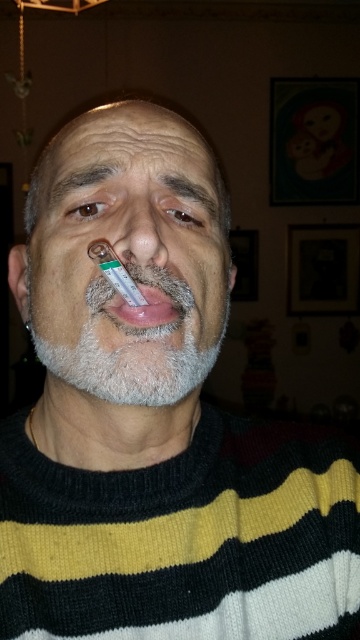
Question: Which of these objects is positioned farthest from the white matte thermometer at center?

Choices:
 (A) gray hair at upper center
 (B) brown hair at upper center

Answer: (B)

Question: Which point appears closest to the camera in this image?

Choices:
 (A) (62, 289)
 (B) (141, 202)
 (C) (106, 314)

Answer: (C)

Question: In this image, where is smooth skin nose at center located relative to gray hair at upper center?

Choices:
 (A) right
 (B) left

Answer: (A)

Question: Is pink glossy lips at center closer to camera compared to brown hair at upper center?

Choices:
 (A) yes
 (B) no

Answer: (A)

Question: Observing the image, what is the correct spatial positioning of smooth skin nose at center in reference to brown hair at upper center?

Choices:
 (A) left
 (B) right

Answer: (A)

Question: Among these points, which one is nearest to the camera?

Choices:
 (A) (129, 240)
 (B) (101, 182)

Answer: (A)